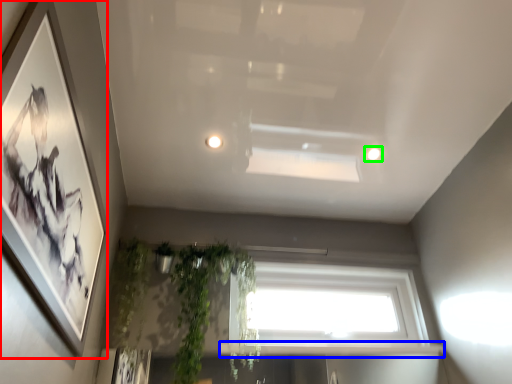
Question: Based on their relative distances, which object is nearer to picture frame (highlighted by a red box)? Choose from window sill (highlighted by a blue box) and lighting (highlighted by a green box).

Choices:
 (A) window sill
 (B) lighting

Answer: (A)